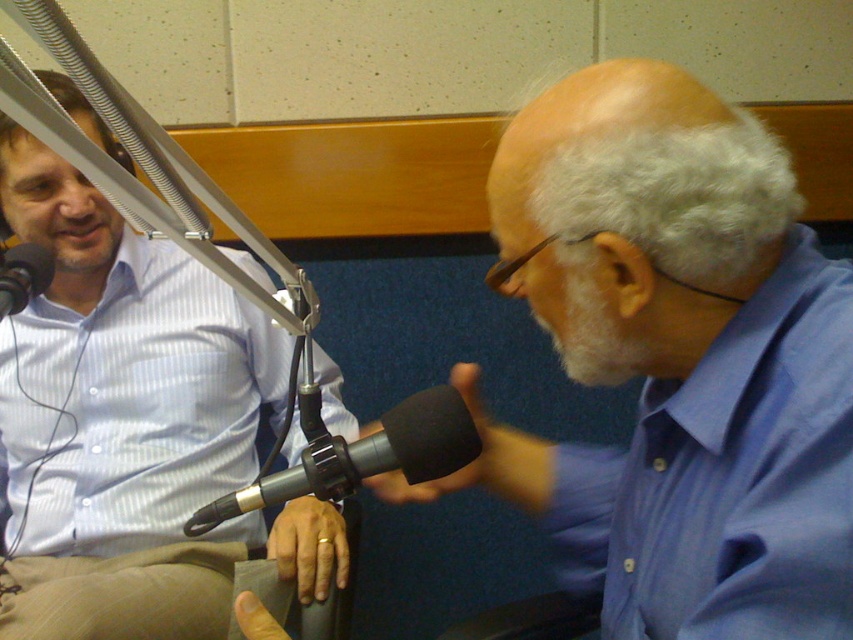
Between blue glossy shirt at right and black matte microphone at left, which one has less height?

black matte microphone at left is shorter.

Is point (579, 244) farther from viewer compared to point (9, 268)?

No, it is in front of (9, 268).

Is point (523, 458) positioned after point (9, 305)?

Yes, it is behind point (9, 305).

Identify the location of blue glossy shirt at right. click(675, 362).

Does matte blue shirt at left appear on the right side of black matte microphone at center?

No, matte blue shirt at left is not to the right of black matte microphone at center.

Find the location of a particular element. The width and height of the screenshot is (853, 640). matte blue shirt at left is located at coordinates (131, 426).

Does matte blue shirt at left have a lesser height compared to blue striped shirt at upper right?

No, matte blue shirt at left is not shorter than blue striped shirt at upper right.

Between point (138, 518) and point (840, 467), which one is positioned behind?

Positioned behind is point (138, 518).

This screenshot has height=640, width=853. Find the location of `matte blue shirt at left`. matte blue shirt at left is located at coordinates (131, 426).